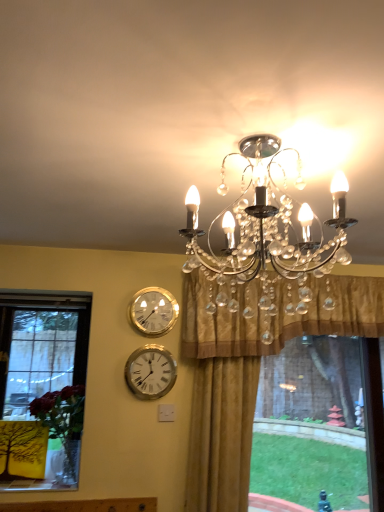
Question: From a real-world perspective, is gold satin curtain at upper center physically located above or below gold metallic wall clock at upper center, which is the first wall clock in top-to-bottom order?

Choices:
 (A) above
 (B) below

Answer: (A)

Question: Relative to gold metallic wall clock at upper center, which is the 2th wall clock in bottom-to-top order, is gold satin curtain at upper center in front or behind?

Choices:
 (A) behind
 (B) front

Answer: (B)

Question: Estimate the real-world distances between objects in this image. Which object is farther from the gold metallic wall clock at upper center, which is the 2th wall clock in bottom-to-top order?

Choices:
 (A) gold satin curtain at upper center
 (B) clear crystal chandelier at upper center
 (C) white metallic clock at center, marked as the second wall clock in a top-to-bottom arrangement

Answer: (B)

Question: Which is nearer to the clear crystal chandelier at upper center?

Choices:
 (A) gold metallic wall clock at upper center, which is the first wall clock in top-to-bottom order
 (B) white metallic clock at center, marked as the second wall clock in a top-to-bottom arrangement
 (C) gold satin curtain at upper center

Answer: (C)